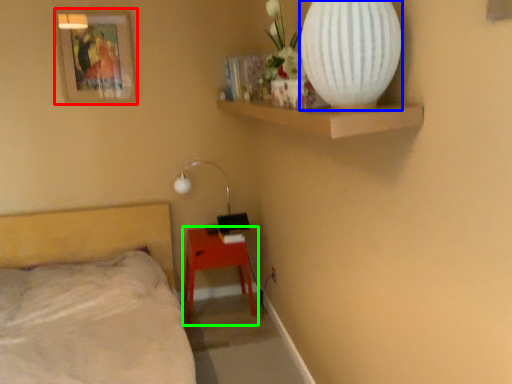
Question: Estimate the real-world distances between objects in this image. Which object is farther from picture frame (highlighted by a red box), vase (highlighted by a blue box) or nightstand (highlighted by a green box)?

Choices:
 (A) vase
 (B) nightstand

Answer: (A)